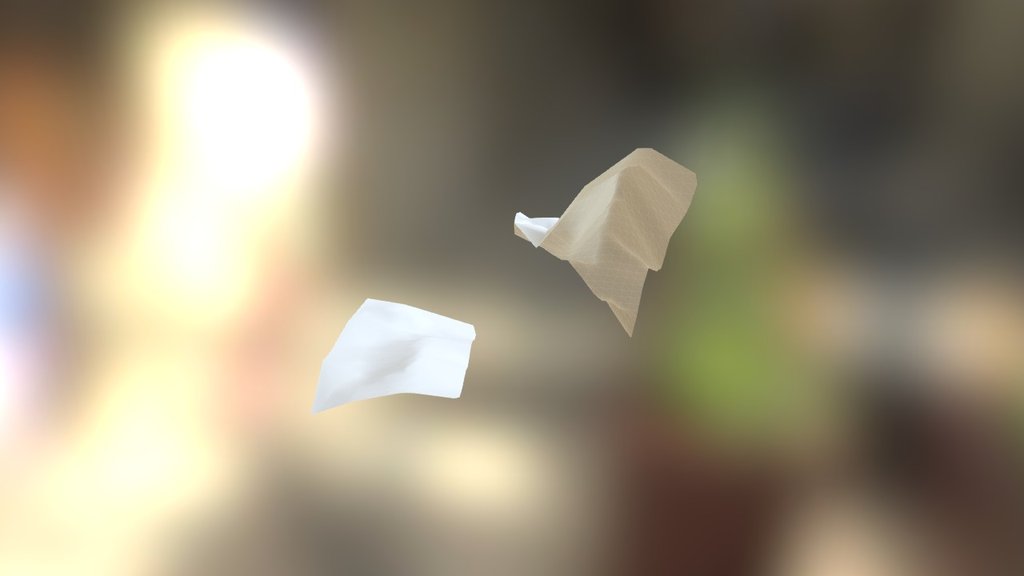
I want to click on piece of paper, so click(x=389, y=357), click(x=621, y=228).